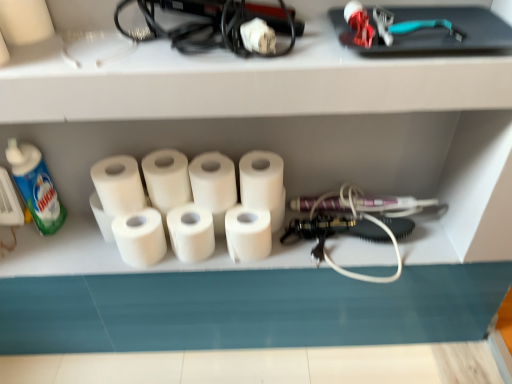
Where is `spots to the right of green matte bottle at left`? spots to the right of green matte bottle at left is located at coordinates (84, 233).